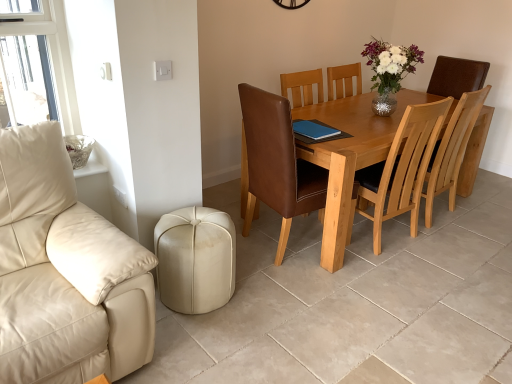
Where is `vacant space in front of brown leather chair at center, the first chair positioned from the left`? vacant space in front of brown leather chair at center, the first chair positioned from the left is located at coordinates (314, 291).